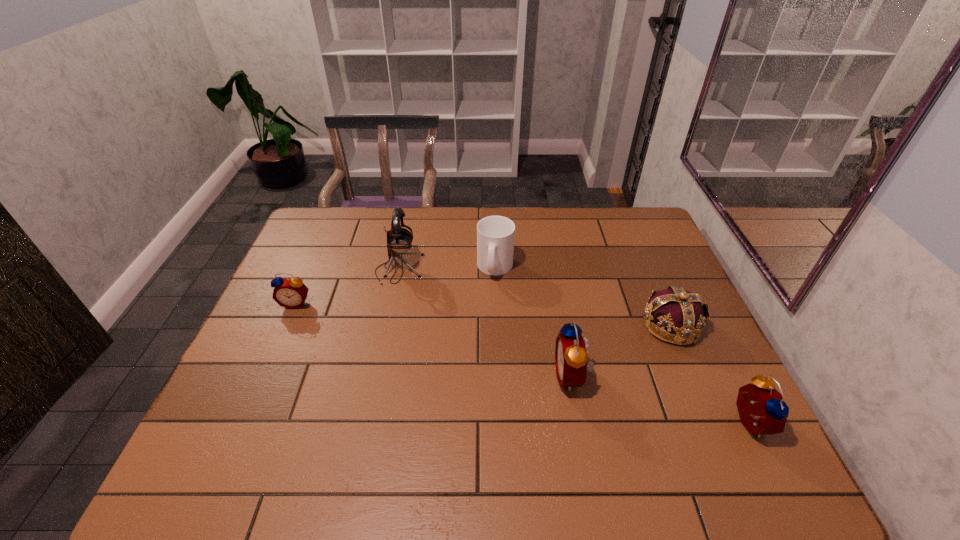
This screenshot has height=540, width=960. In order to click on crown at the right edge in this screenshot , I will do `click(680, 312)`.

What are the coordinates of `object that is at the near right corner` in the screenshot? It's located at (762, 411).

Locate an element on the screen. free region at the far edge of the desktop is located at coordinates (378, 230).

The image size is (960, 540). Identify the location of free spot at the near edge of the desktop. (352, 435).

The image size is (960, 540). Find the location of `vacant space at the left edge of the desktop`. vacant space at the left edge of the desktop is located at coordinates (292, 339).

Image resolution: width=960 pixels, height=540 pixels. I want to click on free space at the right edge, so [669, 274].

At what (x,y) coordinates should I click in order to perform the action: click on free space at the far left corner. Please return your answer as a coordinate pair (x, y). This screenshot has width=960, height=540. Looking at the image, I should click on (331, 236).

Find the location of a particular element. The height and width of the screenshot is (540, 960). free space at the near left corner of the desktop is located at coordinates (230, 411).

At what (x,y) coordinates should I click in order to perform the action: click on vacant space at the far right corner of the desktop. Please return your answer as a coordinate pair (x, y). The width and height of the screenshot is (960, 540). Looking at the image, I should click on (631, 216).

Identify the location of free space between the leftmost object and the nearest object. (521, 363).